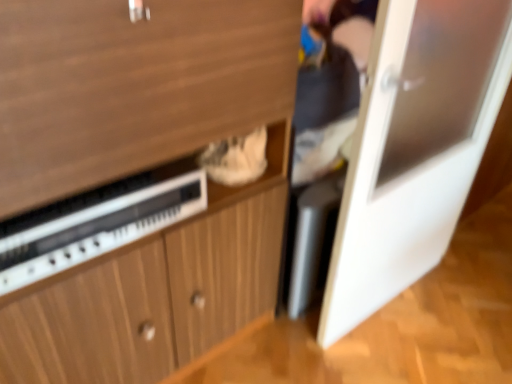
Question: In terms of width, does white glossy door at right look wider or thinner when compared to wooden cabinet at center?

Choices:
 (A) wide
 (B) thin

Answer: (B)

Question: Considering the positions of white glossy door at right and wooden cabinet at center in the image, is white glossy door at right bigger or smaller than wooden cabinet at center?

Choices:
 (A) big
 (B) small

Answer: (B)

Question: Based on their relative distances, which object is farther from the wooden cabinet at center?

Choices:
 (A) white glossy door at right
 (B) white plastic radio at lower left

Answer: (A)

Question: Estimate the real-world distances between objects in this image. Which object is farther from the wooden cabinet at center?

Choices:
 (A) white glossy door at right
 (B) white plastic radio at lower left

Answer: (A)